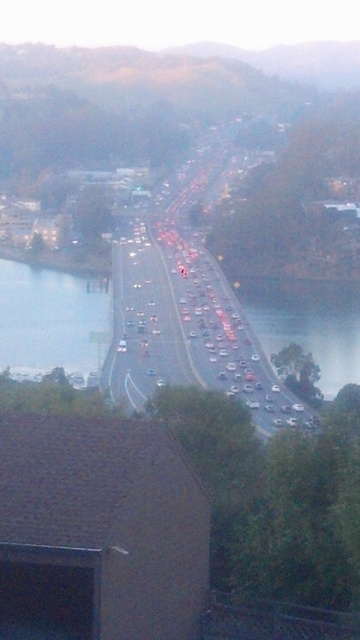
Consider the image. Does clear water at lower left appear on the left side of clear water at lower right?

Yes, clear water at lower left is to the left of clear water at lower right.

Does point (16, 285) come in front of point (295, 330)?

No.

Which is behind, point (102, 333) or point (349, 340)?

Positioned behind is point (349, 340).

The width and height of the screenshot is (360, 640). In order to click on clear water at lower left in this screenshot , I will do `click(51, 320)`.

Between point (146, 358) and point (246, 291), which one is positioned behind?

The point (146, 358) is behind.

How far apart are metallic silver highway at center and clear water at lower right?

metallic silver highway at center is 1.35 meters away from clear water at lower right.

Is point (186, 188) positioned before point (352, 291)?

No, it is not.

At what (x,y) coordinates should I click in order to perform the action: click on metallic silver highway at center. Please return your answer as a coordinate pair (x, y). Image resolution: width=360 pixels, height=640 pixels. Looking at the image, I should click on [186, 304].

Is point (239, 317) closer to viewer compared to point (7, 314)?

Yes.

Who is positioned more to the left, metallic silver highway at center or clear water at lower left?

clear water at lower left

Find the location of `metallic silver highway at center`. metallic silver highway at center is located at coordinates (186, 304).